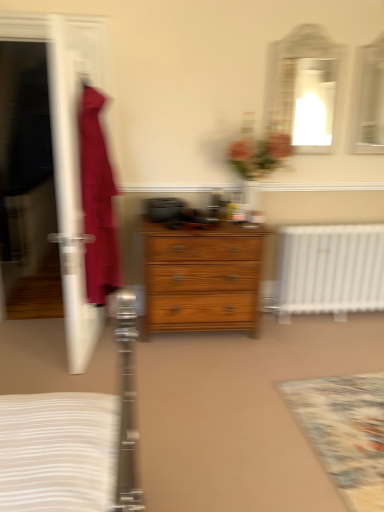
The image size is (384, 512). What do you see at coordinates (345, 432) in the screenshot?
I see `floral carpet at lower right` at bounding box center [345, 432].

How much space does matte glass mirror at upper center, the 2th mirror when ordered from left to right, occupy vertically?

36.40 inches.

What do you see at coordinates (69, 150) in the screenshot? This screenshot has width=384, height=512. I see `transparent plastic screen door at left` at bounding box center [69, 150].

Measure the distance between matte white mirror at upper right, which appears as the 2th mirror when viewed from the right, and camera.

The distance of matte white mirror at upper right, which appears as the 2th mirror when viewed from the right, from camera is 9.65 feet.

The height and width of the screenshot is (512, 384). Identify the location of matte white mirror at upper right, which is the 1th mirror in left-to-right order. (304, 88).

What do you see at coordinates (203, 278) in the screenshot?
I see `wooden chest of drawers at center` at bounding box center [203, 278].

In order to click on floral carpet at lower right in this screenshot , I will do `click(345, 432)`.

Based on the photo, is matte glass mirror at upper center, the 2th mirror when ordered from left to right, behind matte white mirror at upper right, which appears as the 2th mirror when viewed from the right?

Yes, it is.

Which object is wider, matte glass mirror at upper center, the 2th mirror when ordered from left to right, or matte white mirror at upper right, which is the 1th mirror in left-to-right order?

matte glass mirror at upper center, the 2th mirror when ordered from left to right.

Is matte glass mirror at upper center, the 2th mirror when ordered from left to right, outside of matte white mirror at upper right, which is the 1th mirror in left-to-right order?

Indeed, matte glass mirror at upper center, the 2th mirror when ordered from left to right, is completely outside matte white mirror at upper right, which is the 1th mirror in left-to-right order.

From the image's perspective, which object appears higher, matte glass mirror at upper center, which is the first mirror in right-to-left order, or matte white mirror at upper right, which is the 1th mirror in left-to-right order?

matte glass mirror at upper center, which is the first mirror in right-to-left order, appears higher in the image.

Considering the relative positions of transparent plastic screen door at left and matte white mirror at upper right, which appears as the 2th mirror when viewed from the right, in the image provided, is transparent plastic screen door at left to the left of matte white mirror at upper right, which appears as the 2th mirror when viewed from the right, from the viewer's perspective?

Yes, transparent plastic screen door at left is to the left of matte white mirror at upper right, which appears as the 2th mirror when viewed from the right.

Which is in front, point (77, 80) or point (284, 50)?

The point (77, 80) is closer.

From the image's perspective, which one is positioned higher, transparent plastic screen door at left or matte white mirror at upper right, which appears as the 2th mirror when viewed from the right?

matte white mirror at upper right, which appears as the 2th mirror when viewed from the right, is shown above in the image.

I want to click on screen door in front of the matte white mirror at upper right, which is the 1th mirror in left-to-right order, so click(69, 150).

How different are the orientations of wooden chest of drawers at center and matte glass mirror at upper center, the 2th mirror when ordered from left to right, in degrees?

The facing directions of wooden chest of drawers at center and matte glass mirror at upper center, the 2th mirror when ordered from left to right, are 0.162 degrees apart.

Does wooden chest of drawers at center turn towards matte glass mirror at upper center, which is the first mirror in right-to-left order?

No, wooden chest of drawers at center is not facing towards matte glass mirror at upper center, which is the first mirror in right-to-left order.

Considering the positions of point (240, 229) and point (382, 106), is point (240, 229) closer or farther from the camera than point (382, 106)?

Point (240, 229) appears to be closer to the viewer than point (382, 106).

In the scene shown: From a real-world perspective, which object stands above the other?

From a 3D spatial view, matte glass mirror at upper center, which is the first mirror in right-to-left order, is above.

Does floral carpet at lower right touch wooden chest of drawers at center?

No, floral carpet at lower right is not beside wooden chest of drawers at center.

From the image's perspective, is floral carpet at lower right above or below wooden chest of drawers at center?

Based on their image positions, floral carpet at lower right is located beneath wooden chest of drawers at center.

Is wooden chest of drawers at center completely or partially inside floral carpet at lower right?

→ Definitely not — wooden chest of drawers at center is not inside floral carpet at lower right.

From a real-world perspective, who is located lower, transparent plastic screen door at left or matte glass mirror at upper center, which is the first mirror in right-to-left order?

transparent plastic screen door at left, from a real-world perspective.

Image resolution: width=384 pixels, height=512 pixels. In the image, there is a matte glass mirror at upper center, which is the first mirror in right-to-left order. Identify the location of screen door below it (from a real-world perspective). (69, 150).

Is point (69, 164) closer to viewer compared to point (373, 136)?

Yes, point (69, 164) is in front of point (373, 136).

Choose the correct answer: Is wooden chest of drawers at center inside matte white mirror at upper right, which appears as the 2th mirror when viewed from the right, or outside it?

wooden chest of drawers at center is spatially situated outside matte white mirror at upper right, which appears as the 2th mirror when viewed from the right.

Can you confirm if wooden chest of drawers at center is wider than matte white mirror at upper right, which is the 1th mirror in left-to-right order?

Indeed, wooden chest of drawers at center has a greater width compared to matte white mirror at upper right, which is the 1th mirror in left-to-right order.

From a real-world perspective, is wooden chest of drawers at center above or below matte white mirror at upper right, which is the 1th mirror in left-to-right order?

wooden chest of drawers at center is below matte white mirror at upper right, which is the 1th mirror in left-to-right order.

From a real-world perspective, between matte white mirror at upper right, which appears as the 2th mirror when viewed from the right, and floral carpet at lower right, who is vertically lower?

floral carpet at lower right is physically lower.

Between matte white mirror at upper right, which is the 1th mirror in left-to-right order, and floral carpet at lower right, which one has larger size?

Bigger between the two is floral carpet at lower right.

Which is in front, point (292, 87) or point (363, 468)?

Point (363, 468)

In terms of height, does matte white mirror at upper right, which appears as the 2th mirror when viewed from the right, look taller or shorter compared to floral carpet at lower right?

matte white mirror at upper right, which appears as the 2th mirror when viewed from the right, is taller than floral carpet at lower right.

Where is `mirror located on the left of matte glass mirror at upper center, the 2th mirror when ordered from left to right`? The width and height of the screenshot is (384, 512). mirror located on the left of matte glass mirror at upper center, the 2th mirror when ordered from left to right is located at coordinates (304, 88).

You are a GUI agent. You are given a task and a screenshot of the screen. Output one action in this format:
    pyautogui.click(x=<x>, y=<y>)
    Task: Click on the mirror that is the 1st one when counting backward from the transparent plastic screen door at left
    The image size is (384, 512).
    Given the screenshot: What is the action you would take?
    pyautogui.click(x=304, y=88)

Which object lies nearer to the anchor point matte white mirror at upper right, which appears as the 2th mirror when viewed from the right, transparent plastic screen door at left or floral carpet at lower right?

transparent plastic screen door at left lies closer to matte white mirror at upper right, which appears as the 2th mirror when viewed from the right, than the other object.

Estimate the real-world distances between objects in this image. Which object is further from wooden chest of drawers at center, matte glass mirror at upper center, the 2th mirror when ordered from left to right, or matte white mirror at upper right, which is the 1th mirror in left-to-right order?

matte glass mirror at upper center, the 2th mirror when ordered from left to right, is further to wooden chest of drawers at center.

Based on their spatial positions, is floral carpet at lower right or matte glass mirror at upper center, which is the first mirror in right-to-left order, closer to matte white mirror at upper right, which is the 1th mirror in left-to-right order?

Among the two, matte glass mirror at upper center, which is the first mirror in right-to-left order, is located nearer to matte white mirror at upper right, which is the 1th mirror in left-to-right order.

Considering their positions, is transparent plastic screen door at left positioned closer to floral carpet at lower right than wooden chest of drawers at center?

wooden chest of drawers at center lies closer to floral carpet at lower right than the other object.

When comparing their distances from floral carpet at lower right, does matte glass mirror at upper center, the 2th mirror when ordered from left to right, or transparent plastic screen door at left seem further?

Based on the image, matte glass mirror at upper center, the 2th mirror when ordered from left to right, appears to be further to floral carpet at lower right.

Based on their spatial positions, is matte glass mirror at upper center, which is the first mirror in right-to-left order, or wooden chest of drawers at center closer to matte white mirror at upper right, which is the 1th mirror in left-to-right order?

matte glass mirror at upper center, which is the first mirror in right-to-left order, is positioned closer to the anchor matte white mirror at upper right, which is the 1th mirror in left-to-right order.

Based on their spatial positions, is transparent plastic screen door at left or matte glass mirror at upper center, the 2th mirror when ordered from left to right, further from wooden chest of drawers at center?

matte glass mirror at upper center, the 2th mirror when ordered from left to right, lies further to wooden chest of drawers at center than the other object.

Considering their positions, is wooden chest of drawers at center positioned further to transparent plastic screen door at left than matte glass mirror at upper center, the 2th mirror when ordered from left to right?

The object further to transparent plastic screen door at left is matte glass mirror at upper center, the 2th mirror when ordered from left to right.

The height and width of the screenshot is (512, 384). I want to click on mirror between transparent plastic screen door at left and matte glass mirror at upper center, the 2th mirror when ordered from left to right, in the horizontal direction, so click(304, 88).

Image resolution: width=384 pixels, height=512 pixels. Find the location of `mirror located between transparent plastic screen door at left and floral carpet at lower right in the left-right direction`. mirror located between transparent plastic screen door at left and floral carpet at lower right in the left-right direction is located at coordinates (304, 88).

I want to click on the chest of drawers located between transparent plastic screen door at left and matte white mirror at upper right, which appears as the 2th mirror when viewed from the right, in the left-right direction, so click(203, 278).

The height and width of the screenshot is (512, 384). I want to click on mirror that lies between matte glass mirror at upper center, which is the first mirror in right-to-left order, and wooden chest of drawers at center from top to bottom, so click(x=304, y=88).